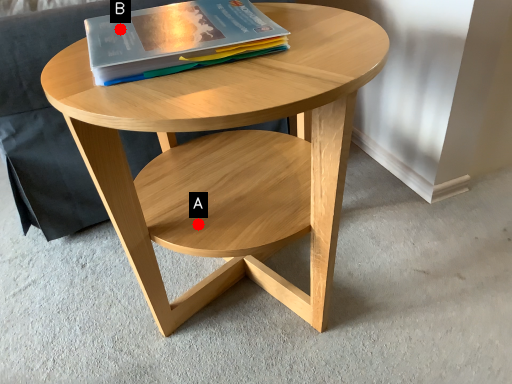
Question: Two points are circled on the image, labeled by A and B beside each circle. Among these points, which one is nearest to the camera?

Choices:
 (A) A is closer
 (B) B is closer

Answer: (B)